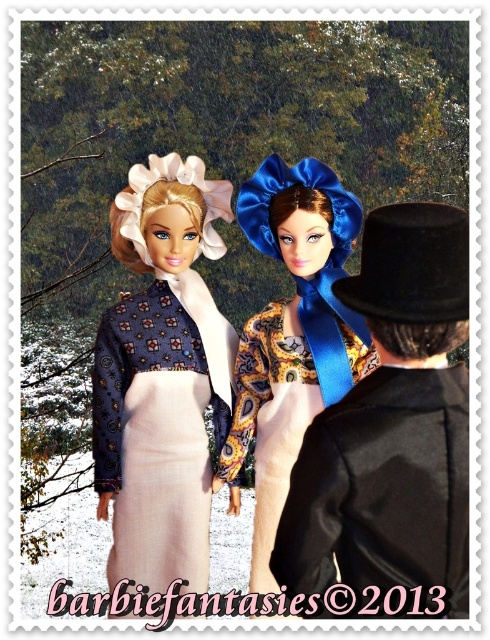
You are a fashion designer who wants to create a matching accessory for the matte blue fabric dress at center and the shiny blue satin bonnet at center. Given that the two items are 10.05 centimeters apart in the image, can you determine if they are close enough to be considered part of the same outfit?

The matte blue fabric dress at center is 10.05 centimeters from the shiny blue satin bonnet at center, so they are close enough to be considered part of the same outfit.

You are taking a photo of the dolls and the figure in the scene. You want to focus on the figure wearing a black top who is partially hidden. Which point, point (138, 500) or point (272, 516), is closer to the camera and thus better for focusing on the figure?

Point (138, 500) is further to the camera than point (272, 516), so focusing on point (138, 500) would be better to capture the figure wearing a black top since it is closer to the camera.

Looking at this image, you are trying to decide which item to take from the scene for a costume party. You need something that is wider. Which one should you choose between the matte blue fabric dress at center and the shiny blue satin bonnet at center?

The shiny blue satin bonnet at center is wider than the matte blue fabric dress at center, so you should choose the shiny blue satin bonnet at center.